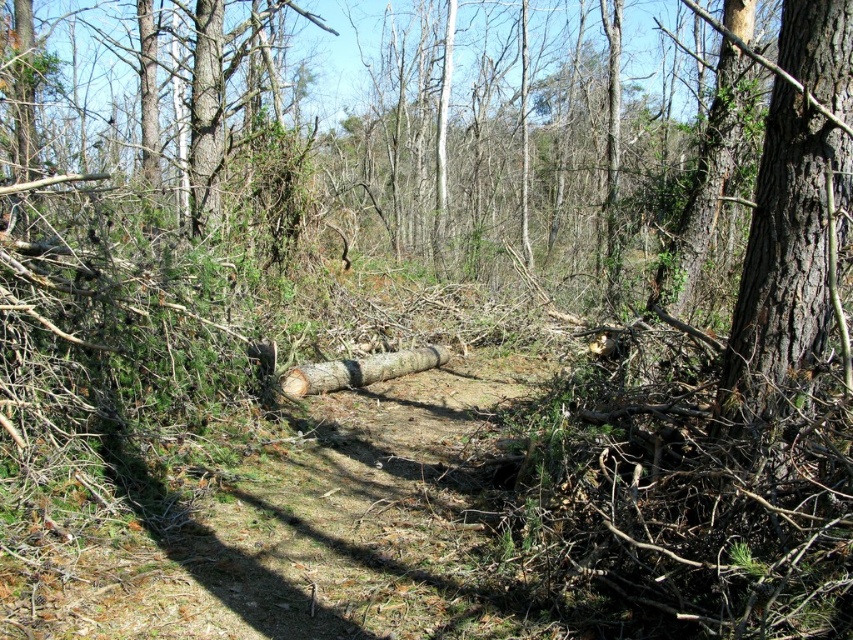
You are a hiker trying to navigate through the wooded area. You notice the smooth brown bark at right and the brown rough log at center. Which object is bigger in size?

The smooth brown bark at right is larger in size compared to the brown rough log at center.

You are a hiker carrying a backpack and need to walk from the smooth brown bark at right to the brown rough log at center. Can you walk directly between them without needing to detour around any obstacles?

The distance between the smooth brown bark at right and the brown rough log at center is 3.48 meters, so yes, you can walk directly between them without needing to detour around any obstacles as there is enough space.